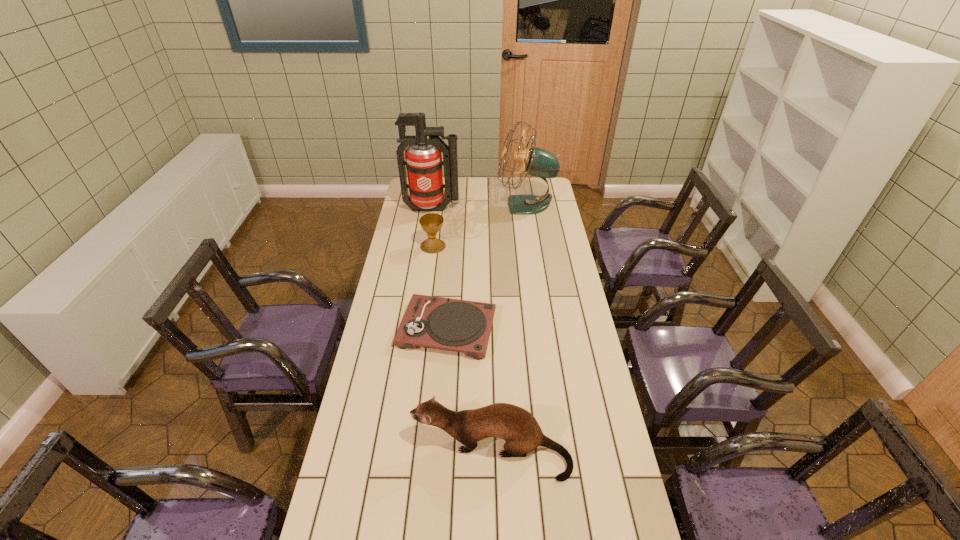
Find the location of `vacant point located between the shortest object and the fire extinguisher`. vacant point located between the shortest object and the fire extinguisher is located at coordinates (440, 269).

This screenshot has width=960, height=540. In order to click on the third closest object to the nearest object in this screenshot , I will do `click(538, 162)`.

The height and width of the screenshot is (540, 960). Find the location of `the closest object to the chalice`. the closest object to the chalice is located at coordinates (423, 157).

What are the coordinates of `vacant region that satisfies the following two spatial constraints: 1. on the front-facing side of the fan for air flow; 2. on the front label side of the fire extinguisher` in the screenshot? It's located at (527, 209).

The width and height of the screenshot is (960, 540). Find the location of `free space in the image that satisfies the following two spatial constraints: 1. on the front-facing side of the fan for air flow; 2. on the front label side of the fire extinguisher`. free space in the image that satisfies the following two spatial constraints: 1. on the front-facing side of the fan for air flow; 2. on the front label side of the fire extinguisher is located at coordinates (527, 209).